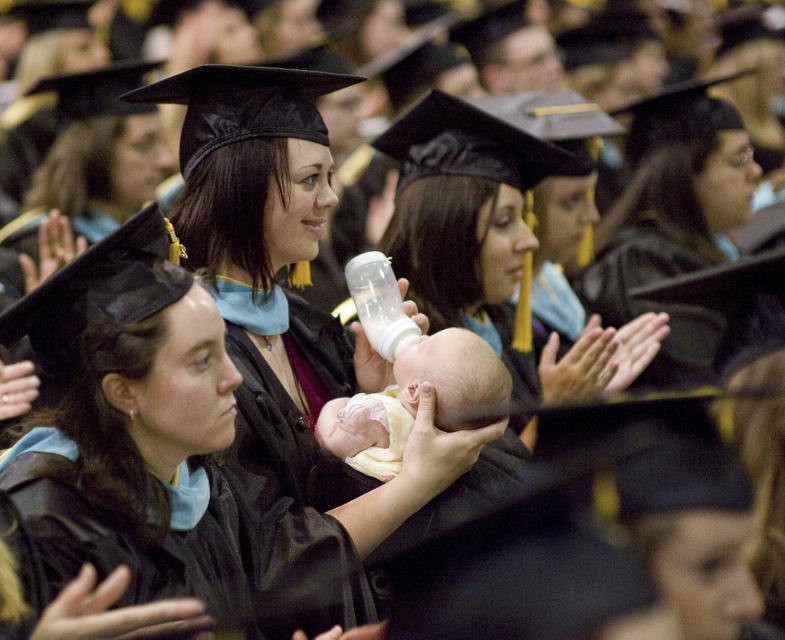
You are a photographer at the graduation ceremony. You need to capture a photo of the matte black graduation cap at center and the soft white skin at center. Which object should you focus on to ensure it appears larger in the photo?

The matte black graduation cap at center is much taller than the soft white skin at center, so focusing on it will make it appear larger in the photo.

You are a photographer at the graduation ceremony. You need to adjust your camera to focus on the matte black graduation cap at center. What is the exact coordinate where you should aim your camera?

The matte black graduation cap at center is located at point (674, 221), so you should aim your camera at those coordinates to focus on it.